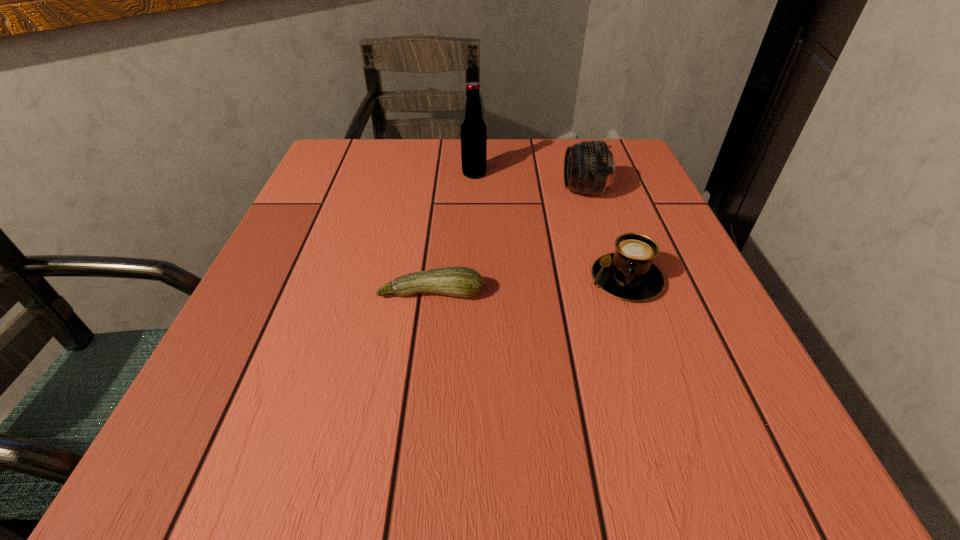
The width and height of the screenshot is (960, 540). I want to click on free space at the far right corner of the desktop, so click(641, 182).

You are a GUI agent. You are given a task and a screenshot of the screen. Output one action in this format:
    pyautogui.click(x=<x>, y=<y>)
    Task: Click on the free space between the shortest object and the telephoto lens
    
    Given the screenshot: What is the action you would take?
    pyautogui.click(x=508, y=242)

Find the location of a particular element. This screenshot has width=960, height=540. empty space between the beer bottle and the third shortest object is located at coordinates (529, 183).

You are a GUI agent. You are given a task and a screenshot of the screen. Output one action in this format:
    pyautogui.click(x=<x>, y=<y>)
    Task: Click on the free space that is in between the zucchini and the telephoto lens
    
    Given the screenshot: What is the action you would take?
    pyautogui.click(x=508, y=242)

Locate an element on the screen. The height and width of the screenshot is (540, 960). free point between the second shortest object and the second tallest object is located at coordinates (605, 235).

Where is `free spot between the cappuccino and the telephoto lens`? The height and width of the screenshot is (540, 960). free spot between the cappuccino and the telephoto lens is located at coordinates (605, 235).

Locate an element on the screen. The width and height of the screenshot is (960, 540). free space between the beer bottle and the cappuccino is located at coordinates (550, 227).

Find the location of a particular element. Image resolution: width=960 pixels, height=540 pixels. free space between the beer bottle and the telephoto lens is located at coordinates (529, 183).

You are a GUI agent. You are given a task and a screenshot of the screen. Output one action in this format:
    pyautogui.click(x=<x>, y=<y>)
    Task: Click on the vacant space in between the second shortest object and the tallest object
    
    Given the screenshot: What is the action you would take?
    pyautogui.click(x=550, y=227)

The width and height of the screenshot is (960, 540). Find the location of `unoccupied area between the beer bottle and the second tallest object`. unoccupied area between the beer bottle and the second tallest object is located at coordinates coord(529,183).